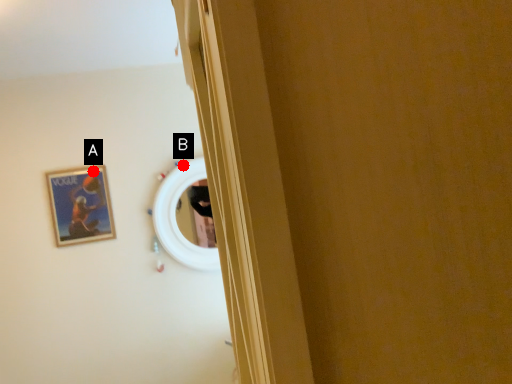
Question: Two points are circled on the image, labeled by A and B beside each circle. Which of the following is the farthest from the observer?

Choices:
 (A) A is further
 (B) B is further

Answer: (B)